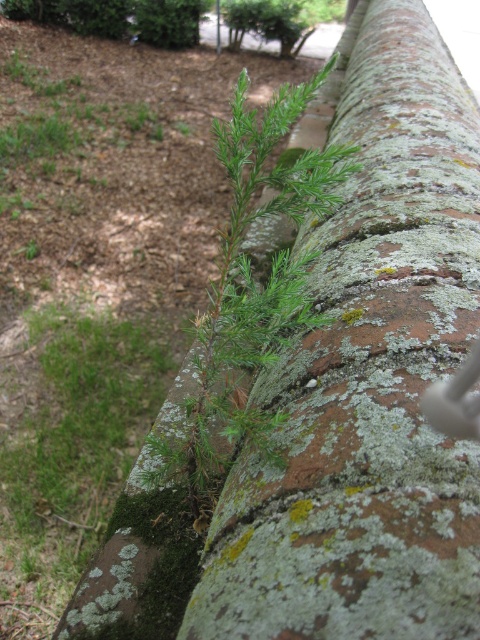
Question: Does green mossy brick wall at upper center appear on the right side of green fuzzy plant at upper center?

Choices:
 (A) no
 (B) yes

Answer: (B)

Question: Where is green mossy brick wall at upper center located in relation to green fuzzy plant at upper center in the image?

Choices:
 (A) left
 (B) right

Answer: (B)

Question: Is green mossy brick wall at upper center wider than green fuzzy plant at upper center?

Choices:
 (A) yes
 (B) no

Answer: (A)

Question: Among these points, which one is farthest from the camera?

Choices:
 (A) (199, 349)
 (B) (372, 461)

Answer: (A)